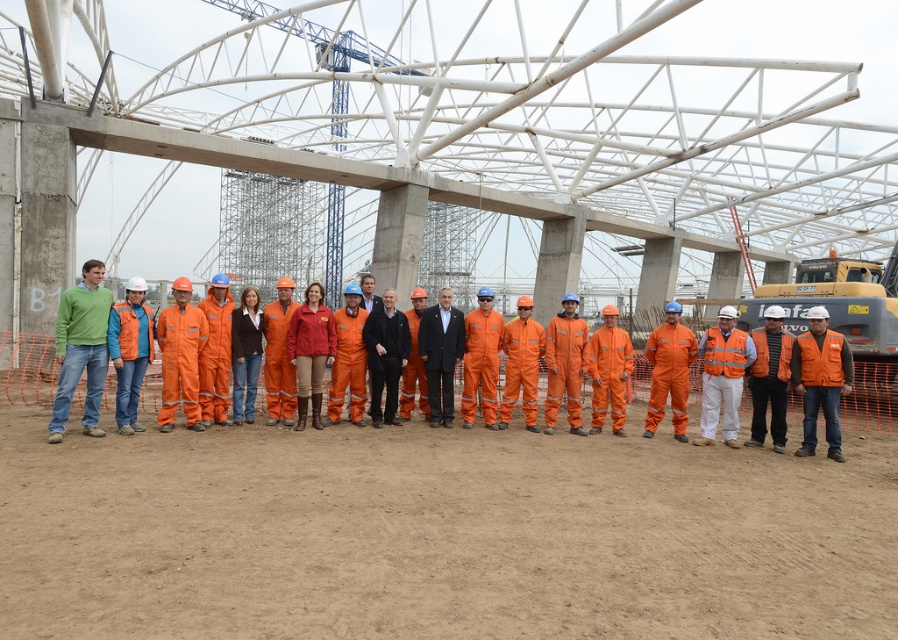
You are a photographer taking a picture of the construction site. You want to ensure both the point at (92,276) and the point at (813,342) are in focus. Which point should you focus on first to ensure both are sharp?

You should focus on the point at (92,276) first because it is closer to the viewer. This ensures that the depth of field will extend from the closer point to the farther one, keeping both in focus.

You are standing at point A located at coordinates point A at 0.333, 0.449. You want to walk to point B located at coordinates point B at (494, 426). The construction site has a safety rule that requires you to stay at least 10 meters away from any workers. Are you able to walk directly from point A to point B without violating the safety rule?

The distance between point A at 0.333, 0.449 and point B at (494, 426) is 9.74 meters. Since the safety rule requires staying at least 10 meters away from workers, walking directly between them would violate the rule as the distance is less than required.